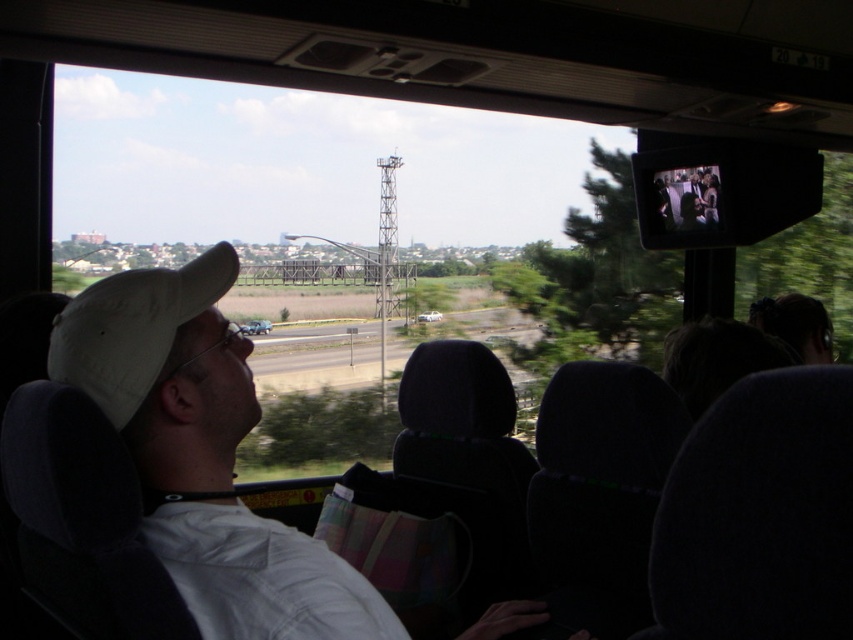
You are sitting in the rear seat of the bus and notice two points marked in the image. Which of these points, point (190, 301) or point (192, 276), is closer to you?

Point (190, 301) is closer to the camera than point (192, 276).

You are a passenger on the bus and want to know which object is bigger between the white matte cap at upper left and the white matte baseball hat at left. Which one is larger?

The white matte cap at upper left has a larger size compared to the white matte baseball hat at left, so the white matte cap at upper left is bigger.